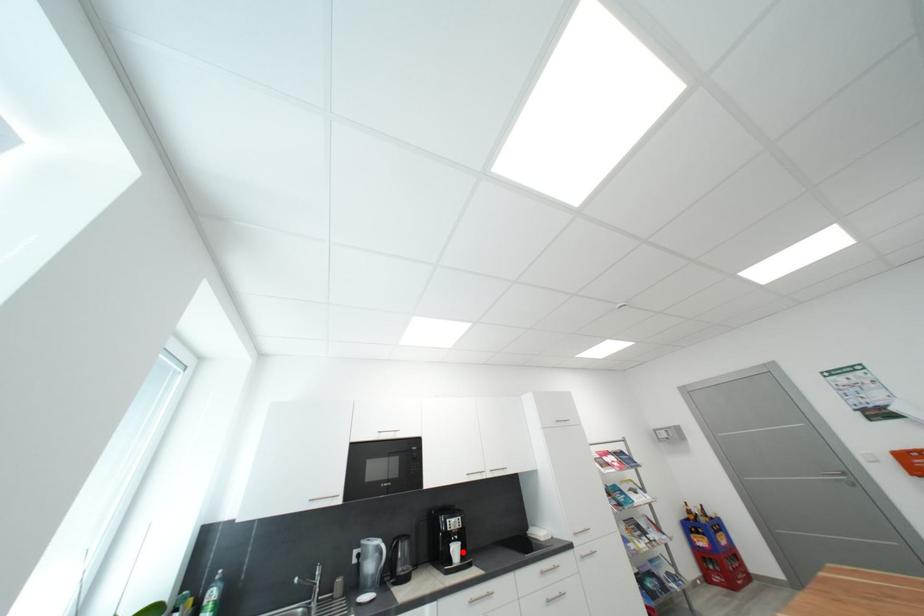
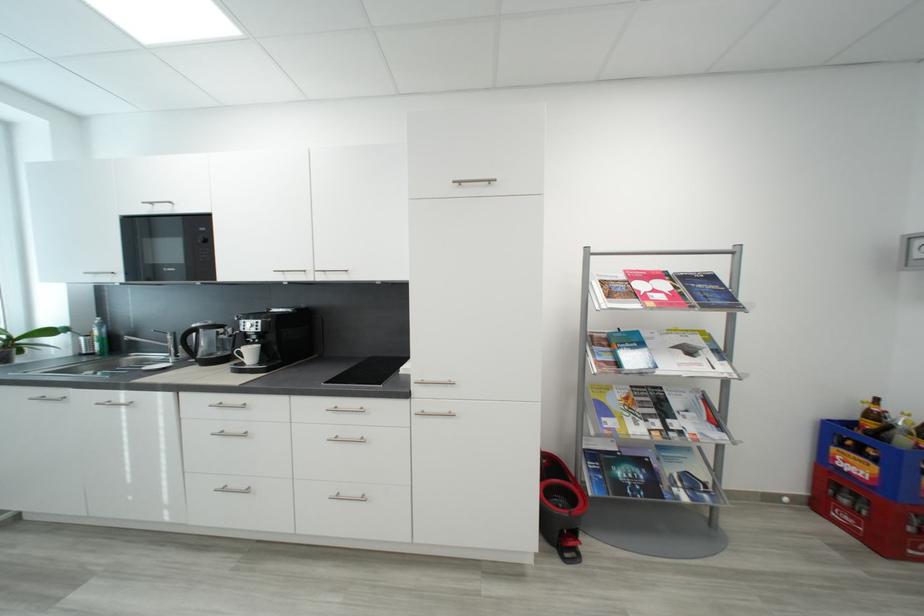
In the second image, find the point that corresponds to the highlighted location in the first image.

(257, 354)